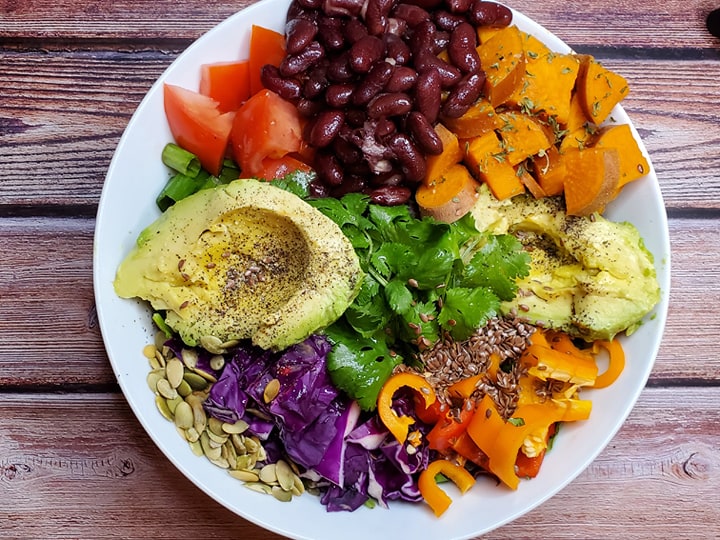
Where is `grain of wood`? The image size is (720, 540). grain of wood is located at coordinates (670, 330), (708, 330), (688, 159), (693, 167), (693, 176).